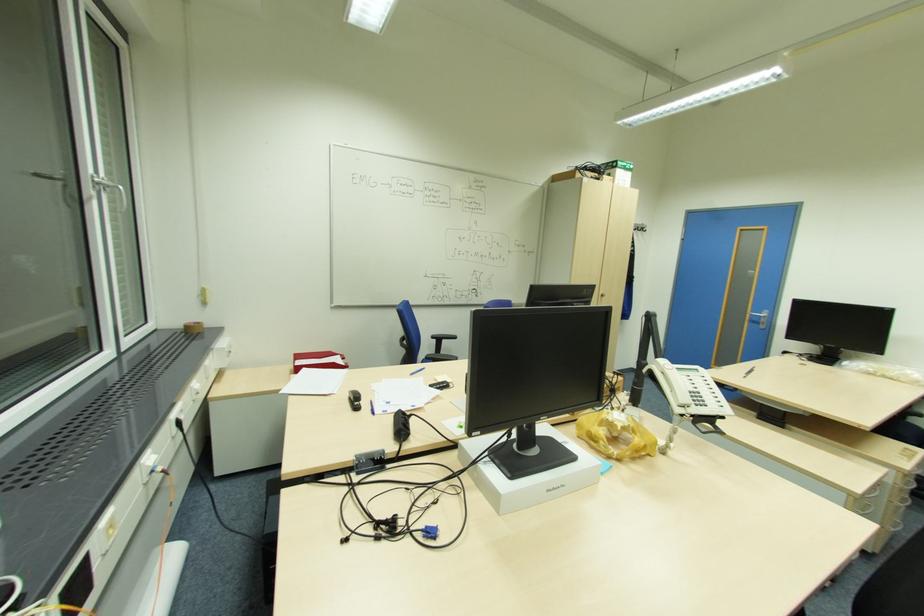
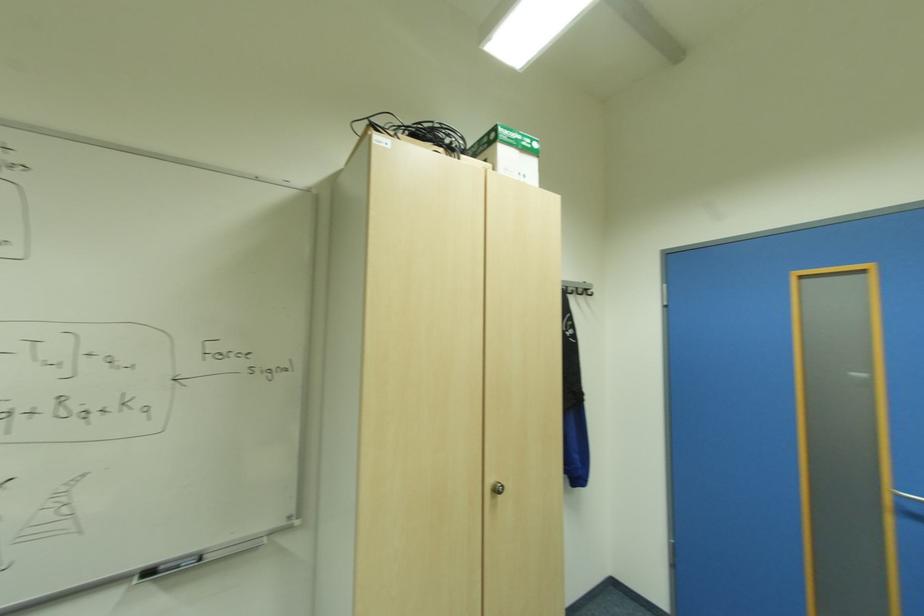
Find the pixel in the second image that matches point (634, 164) in the first image.

(533, 140)